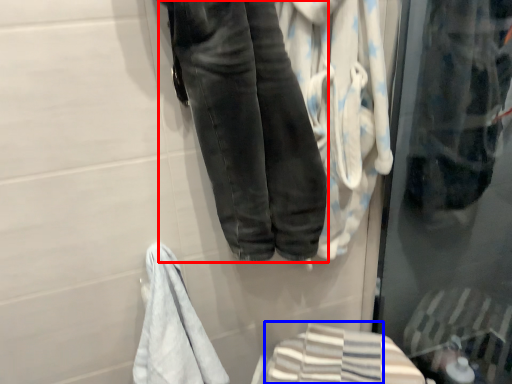
Question: Which point is further to the camera, trousers (highlighted by a red box) or bath towel (highlighted by a blue box)?

Choices:
 (A) trousers
 (B) bath towel

Answer: (B)